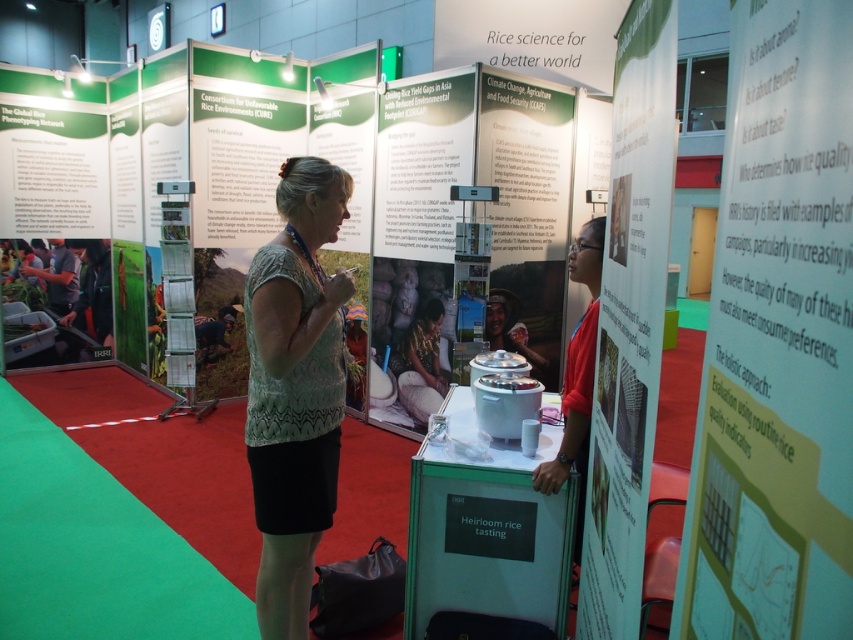
Question: Considering the real-world distances, which object is farthest from the white paper at center?

Choices:
 (A) green textured blouse at center
 (B) white paper at upper right

Answer: (A)

Question: Considering the relative positions of white paper at upper right and green textured blouse at center in the image provided, where is white paper at upper right located with respect to green textured blouse at center?

Choices:
 (A) above
 (B) below

Answer: (A)

Question: Which point is farther from the camera taking this photo?

Choices:
 (A) (633, 378)
 (B) (289, 515)
 (C) (811, 56)

Answer: (B)

Question: Observing the image, what is the correct spatial positioning of white paper at upper right in reference to green textured blouse at center?

Choices:
 (A) below
 (B) above

Answer: (B)

Question: From the image, what is the correct spatial relationship of white paper at center in relation to green textured blouse at center?

Choices:
 (A) left
 (B) right

Answer: (B)

Question: Which point is farther from the camera taking this photo?

Choices:
 (A) (300, 586)
 (B) (727, 365)

Answer: (A)